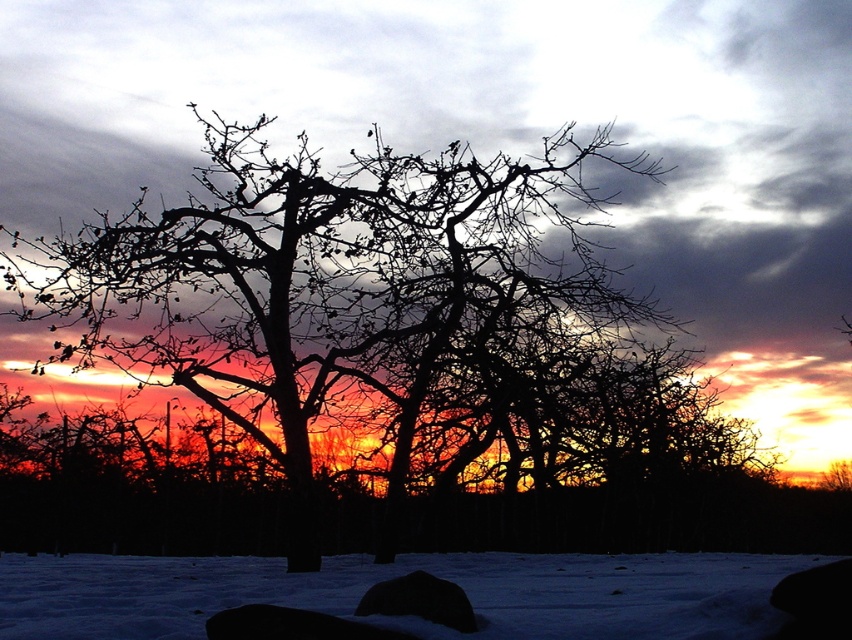
Question: In this image, where is black silhouette tree at center located relative to white powdery snow at lower center?

Choices:
 (A) below
 (B) above

Answer: (B)

Question: In this image, where is black silhouette tree at center located relative to white powdery snow at lower center?

Choices:
 (A) below
 (B) above

Answer: (B)

Question: Does black silhouette tree at center have a smaller size compared to white powdery snow at lower center?

Choices:
 (A) no
 (B) yes

Answer: (A)